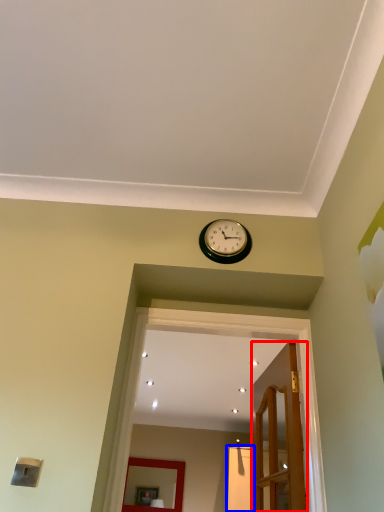
Question: Which object is further to the camera taking this photo, door (highlighted by a red box) or glass door (highlighted by a blue box)?

Choices:
 (A) door
 (B) glass door

Answer: (B)